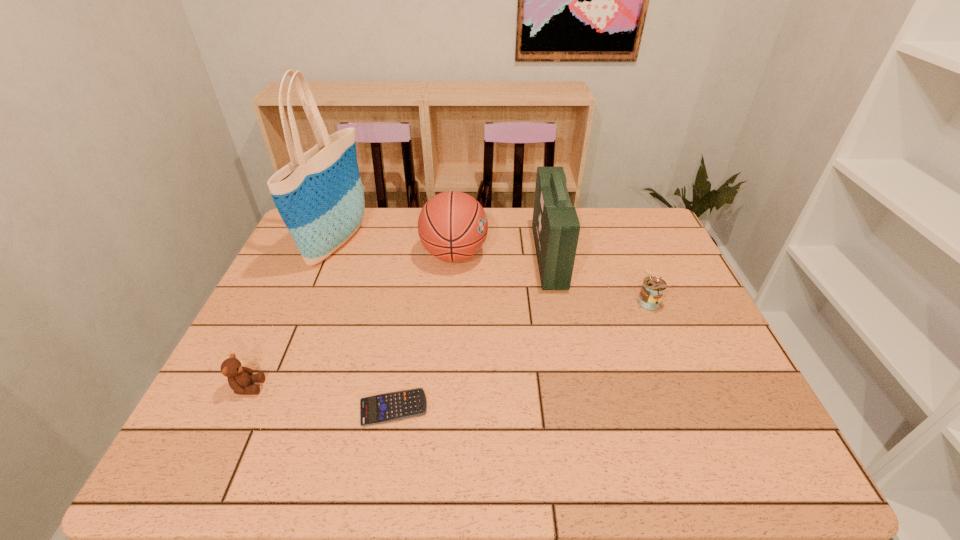
This screenshot has height=540, width=960. I want to click on free space that satisfies the following two spatial constraints: 1. on the front side of the shortest object; 2. on the right side of the tallest object, so click(x=272, y=407).

The height and width of the screenshot is (540, 960). Identify the location of vacant area in the image that satisfies the following two spatial constraints: 1. on the face of the calculator; 2. on the right side of the fifth tallest object. (238, 407).